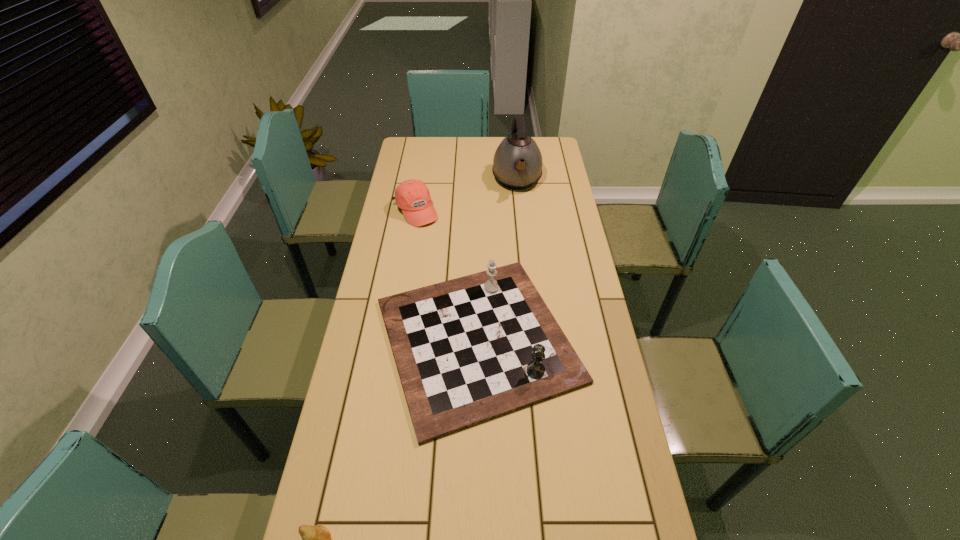
This screenshot has width=960, height=540. Find the location of `kettle`. kettle is located at coordinates pyautogui.click(x=517, y=164).

The width and height of the screenshot is (960, 540). What are the coordinates of `the third farthest object` in the screenshot? It's located at (467, 350).

This screenshot has height=540, width=960. What are the coordinates of `gameboard` in the screenshot? It's located at (467, 350).

Locate an element on the screen. This screenshot has width=960, height=540. baseball cap is located at coordinates (412, 196).

Where is `vacant space located 0.210m at the spout of the kettle`? The width and height of the screenshot is (960, 540). vacant space located 0.210m at the spout of the kettle is located at coordinates pos(522,234).

Find the location of a particular element. This screenshot has width=960, height=540. free space located 0.280m on the back of the second nearest object is located at coordinates (478, 217).

Where is `free space located 0.160m on the back of the baseball cap`? This screenshot has height=540, width=960. free space located 0.160m on the back of the baseball cap is located at coordinates (421, 174).

Where is `object located in the far edge section of the desktop`? object located in the far edge section of the desktop is located at coordinates (517, 164).

Locate an element on the screen. gameboard present at the left edge is located at coordinates (467, 350).

Identify the location of baseball cap present at the left edge. This screenshot has height=540, width=960. (412, 196).